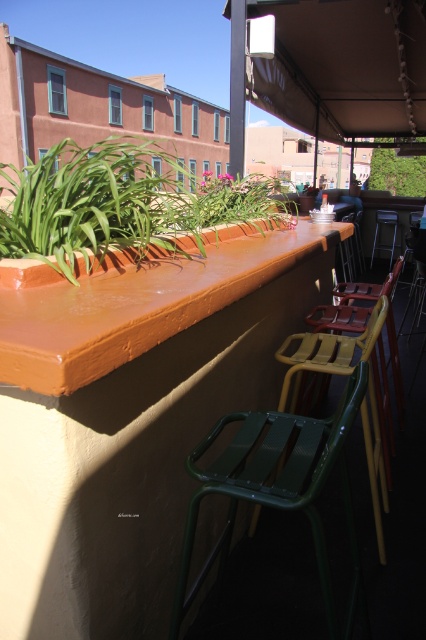
Does brown fabric canopy at upper center have a larger size compared to matte green plastic chair at center?

Indeed, brown fabric canopy at upper center has a larger size compared to matte green plastic chair at center.

Locate an element on the screen. This screenshot has height=640, width=426. brown fabric canopy at upper center is located at coordinates tap(342, 67).

Is brown fabric canopy at upper center below green plastic chair at center?

No.

What do you see at coordinates (342, 67) in the screenshot? Image resolution: width=426 pixels, height=640 pixels. I see `brown fabric canopy at upper center` at bounding box center [342, 67].

Does point (328, 131) come farther from viewer compared to point (331, 349)?

Yes, it is behind point (331, 349).

Where is `brown fabric canopy at upper center`? The height and width of the screenshot is (640, 426). brown fabric canopy at upper center is located at coordinates (342, 67).

Which is behind, point (181, 595) or point (382, 150)?

The point (382, 150) is more distant.

Does point (310, 525) come in front of point (417, 156)?

Yes, it is.

Does point (250, 445) come farther from viewer compared to point (420, 189)?

No, it is in front of (420, 189).

Where is `green metal chair at center`? This screenshot has height=640, width=426. green metal chair at center is located at coordinates click(x=278, y=486).